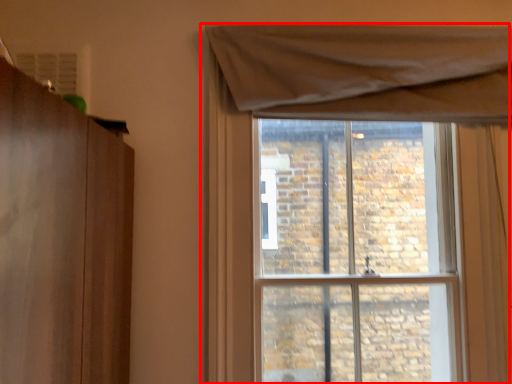
Question: Observing the image, what is the correct spatial positioning of window (annotated by the red box) in reference to window screen?

Choices:
 (A) right
 (B) left

Answer: (B)